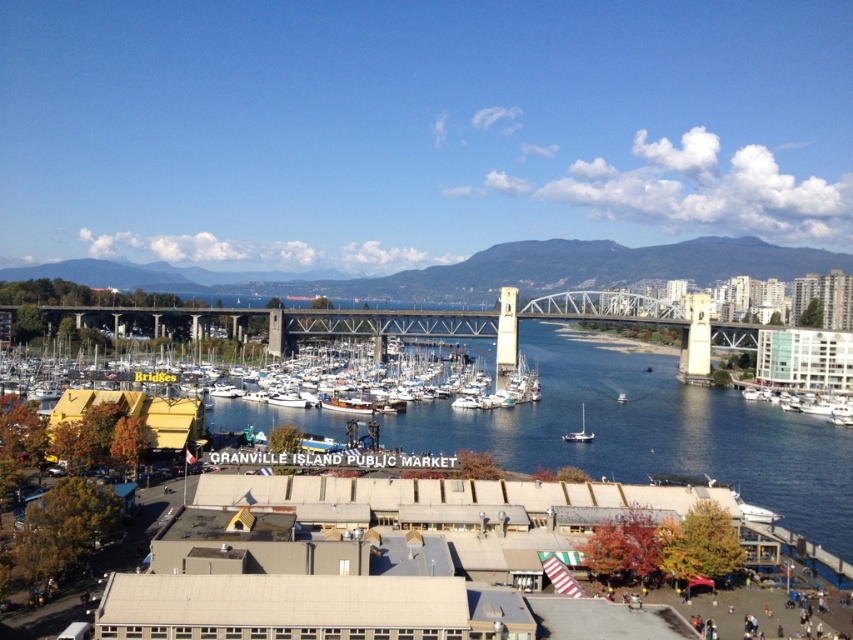
You are a photographer trying to capture both the white glossy boat at right and the white matte boat at center in a single shot. Based on their positions, which boat should you adjust your camera to focus on first to include both in the frame?

You should focus on the white glossy boat at right first since it is positioned to the right of the white matte boat at center, allowing you to frame both by adjusting the camera to include both boats from left to right.

You are a tour guide explaining the waterfront scene to visitors. You point out the white matte boats at center and the white matte boat at center. Which one is positioned higher in the image?

The white matte boats at center is positioned higher than the white matte boat at center.